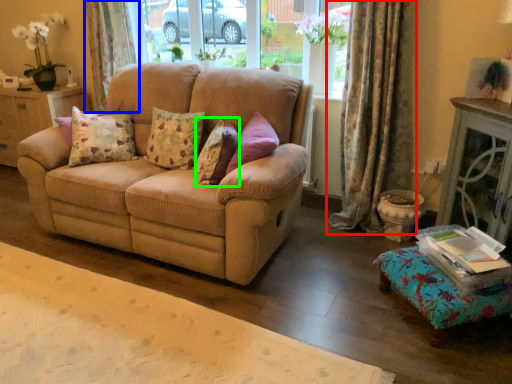
Question: Based on their relative distances, which object is farther from curtain (highlighted by a red box)? Choose from curtain (highlighted by a blue box) and pillow (highlighted by a green box).

Choices:
 (A) curtain
 (B) pillow

Answer: (A)